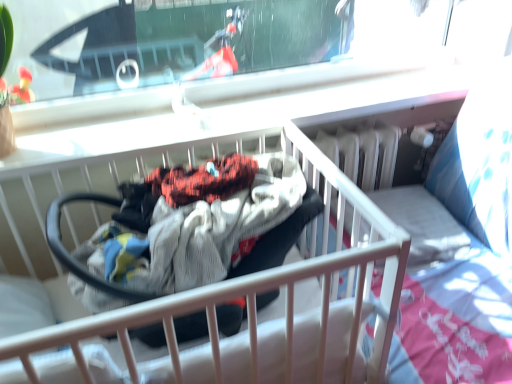
Question: From the image's perspective, is white fabric infant bed at center positioned above or below black rubber baby carriage at center?

Choices:
 (A) above
 (B) below

Answer: (B)

Question: Considering the positions of white fabric infant bed at center and black rubber baby carriage at center in the image, is white fabric infant bed at center wider or thinner than black rubber baby carriage at center?

Choices:
 (A) thin
 (B) wide

Answer: (B)

Question: Which is correct: white fabric infant bed at center is inside black rubber baby carriage at center, or outside of it?

Choices:
 (A) inside
 (B) outside

Answer: (B)

Question: From a real-world perspective, relative to white fabric infant bed at center, is black rubber baby carriage at center vertically above or below?

Choices:
 (A) below
 (B) above

Answer: (B)

Question: From the image's perspective, is black rubber baby carriage at center positioned above or below white fabric infant bed at center?

Choices:
 (A) below
 (B) above

Answer: (B)

Question: Relative to white fabric infant bed at center, is black rubber baby carriage at center in front or behind?

Choices:
 (A) front
 (B) behind

Answer: (B)

Question: Considering the positions of black rubber baby carriage at center and white fabric infant bed at center in the image, is black rubber baby carriage at center taller or shorter than white fabric infant bed at center?

Choices:
 (A) short
 (B) tall

Answer: (A)